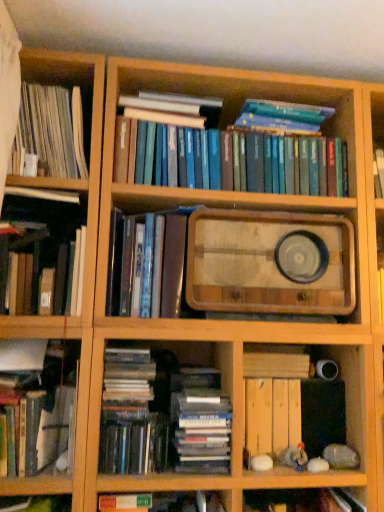
Question: From a real-world perspective, is wooden tray at center located higher than shiny black book at lower left, the seventh book positioned from the top?

Choices:
 (A) yes
 (B) no

Answer: (A)

Question: Is wooden tray at center oriented towards shiny black book at lower left, the first book ordered from the bottom?

Choices:
 (A) no
 (B) yes

Answer: (A)

Question: Is wooden tray at center positioned in front of shiny black book at lower left, the seventh book positioned from the top?

Choices:
 (A) yes
 (B) no

Answer: (B)

Question: Are wooden tray at center and shiny black book at lower left, the seventh book positioned from the top, located far from each other?

Choices:
 (A) no
 (B) yes

Answer: (A)

Question: Does wooden tray at center have a greater height compared to shiny black book at lower left, the first book ordered from the bottom?

Choices:
 (A) yes
 (B) no

Answer: (A)

Question: Considering the relative positions of shiny metallic book at center, the fourth book when ordered from bottom to top, and shiny black book at lower left, the seventh book positioned from the top, in the image provided, is shiny metallic book at center, the fourth book when ordered from bottom to top, to the left or to the right of shiny black book at lower left, the seventh book positioned from the top,?

Choices:
 (A) right
 (B) left

Answer: (A)

Question: Choose the correct answer: Is shiny metallic book at center, which ranks as the 4th book in top-to-bottom order, inside shiny black book at lower left, the seventh book positioned from the top, or outside it?

Choices:
 (A) outside
 (B) inside

Answer: (A)

Question: Considering the positions of shiny metallic book at center, the fourth book when ordered from bottom to top, and shiny black book at lower left, the seventh book positioned from the top, in the image, is shiny metallic book at center, the fourth book when ordered from bottom to top, taller or shorter than shiny black book at lower left, the seventh book positioned from the top,?

Choices:
 (A) tall
 (B) short

Answer: (A)

Question: Looking at their shapes, would you say shiny metallic book at center, which ranks as the 4th book in top-to-bottom order, is wider or thinner than shiny black book at lower left, the first book ordered from the bottom?

Choices:
 (A) thin
 (B) wide

Answer: (B)

Question: In the image, is shiny metallic book at center, the fourth book when ordered from bottom to top, positioned in front of or behind white paperbacks at left, which is the 1th book in top-to-bottom order?

Choices:
 (A) behind
 (B) front

Answer: (B)

Question: Considering the relative positions of shiny metallic book at center, the fourth book when ordered from bottom to top, and white paperbacks at left, which is the 7th book in bottom-to-top order, in the image provided, is shiny metallic book at center, the fourth book when ordered from bottom to top, to the left or to the right of white paperbacks at left, which is the 7th book in bottom-to-top order,?

Choices:
 (A) left
 (B) right

Answer: (B)

Question: Is shiny metallic book at center, the fourth book when ordered from bottom to top, inside or outside of white paperbacks at left, which is the 7th book in bottom-to-top order?

Choices:
 (A) inside
 (B) outside

Answer: (B)

Question: Considering the positions of shiny metallic book at center, which ranks as the 4th book in top-to-bottom order, and white paperbacks at left, which is the 7th book in bottom-to-top order, in the image, is shiny metallic book at center, which ranks as the 4th book in top-to-bottom order, bigger or smaller than white paperbacks at left, which is the 7th book in bottom-to-top order,?

Choices:
 (A) small
 (B) big

Answer: (A)

Question: Relative to shiny black book at lower left, the seventh book positioned from the top, is wooden planks at lower right in front or behind?

Choices:
 (A) behind
 (B) front

Answer: (A)

Question: In terms of size, does wooden planks at lower right appear bigger or smaller than shiny black book at lower left, the seventh book positioned from the top?

Choices:
 (A) big
 (B) small

Answer: (A)